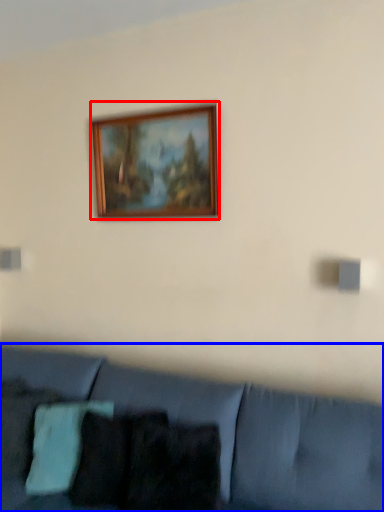
Question: Which of the following is the closest to the observer, picture frame (highlighted by a red box) or studio couch (highlighted by a blue box)?

Choices:
 (A) picture frame
 (B) studio couch

Answer: (B)